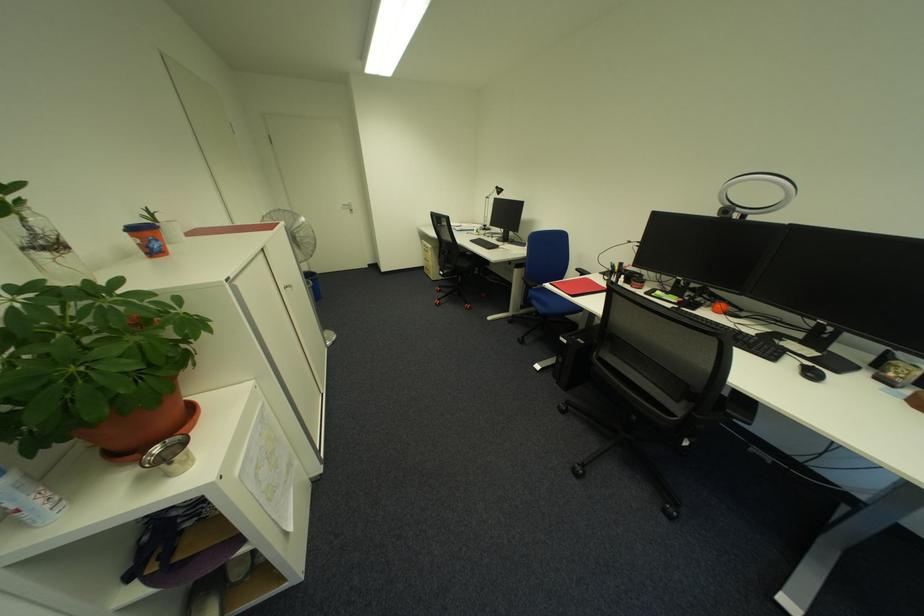
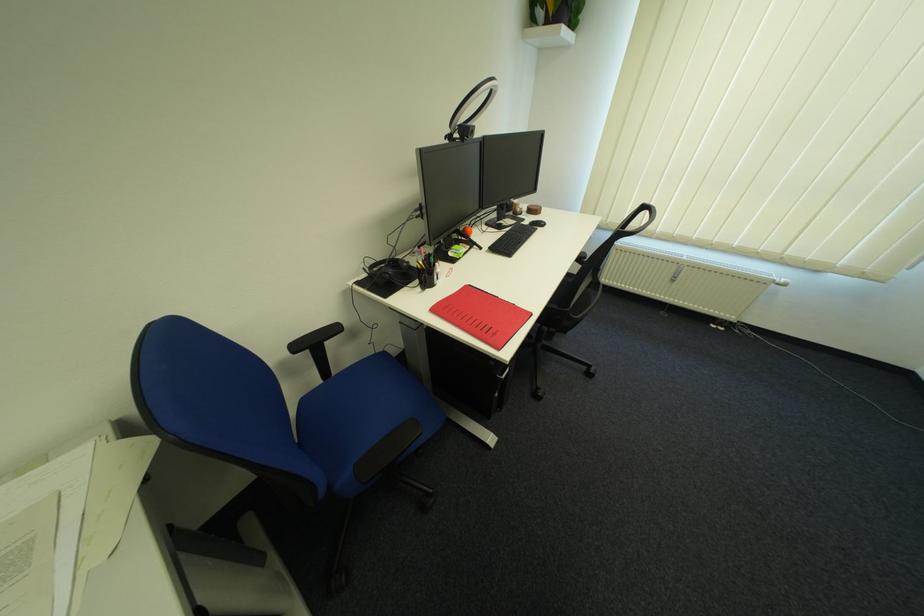
Where in the second image is the point corresponding to (686,302) from the first image?

(479, 248)